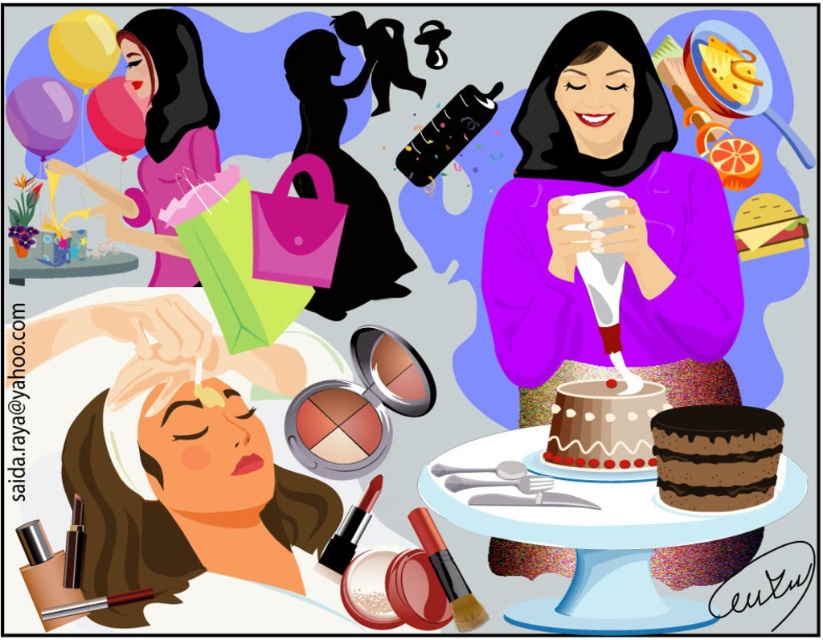
Question: Can you confirm if matte pink dress at upper left is wider than pink glossy balloon at upper left?

Choices:
 (A) no
 (B) yes

Answer: (B)

Question: Can you confirm if purple matte sweater at center is positioned above pink glossy balloon at upper left?

Choices:
 (A) yes
 (B) no

Answer: (B)

Question: Does yellow matte balloon at upper left have a greater width compared to pink glossy balloon at upper left?

Choices:
 (A) yes
 (B) no

Answer: (B)

Question: Which point is farther to the camera?

Choices:
 (A) (105, 134)
 (B) (710, 506)

Answer: (A)

Question: Which object is positioned closest to the purple matte sweater at center?

Choices:
 (A) purple matte balloon at upper left
 (B) yellow matte balloon at upper left

Answer: (B)

Question: Which point appears farthest from the camera in this image?

Choices:
 (A) (605, 432)
 (B) (112, 48)
 (C) (203, 90)
 (D) (15, 106)

Answer: (B)